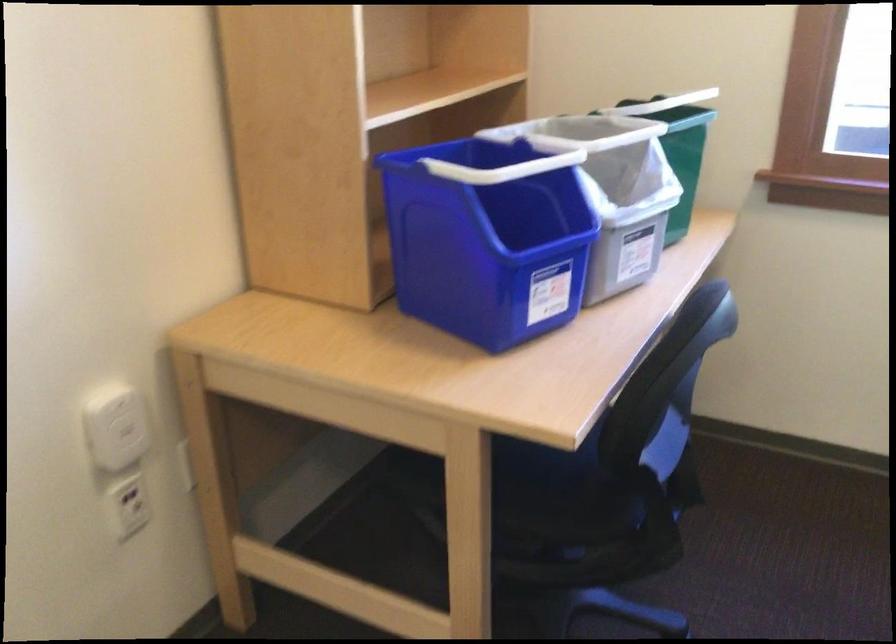
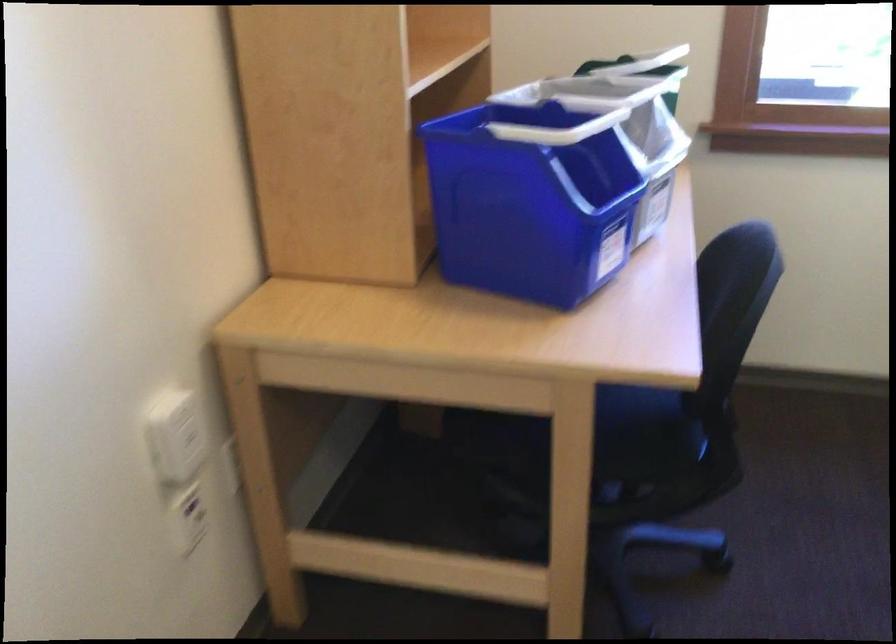
Find the pixel in the second image that matches pixel 583 471 in the first image.

(633, 415)